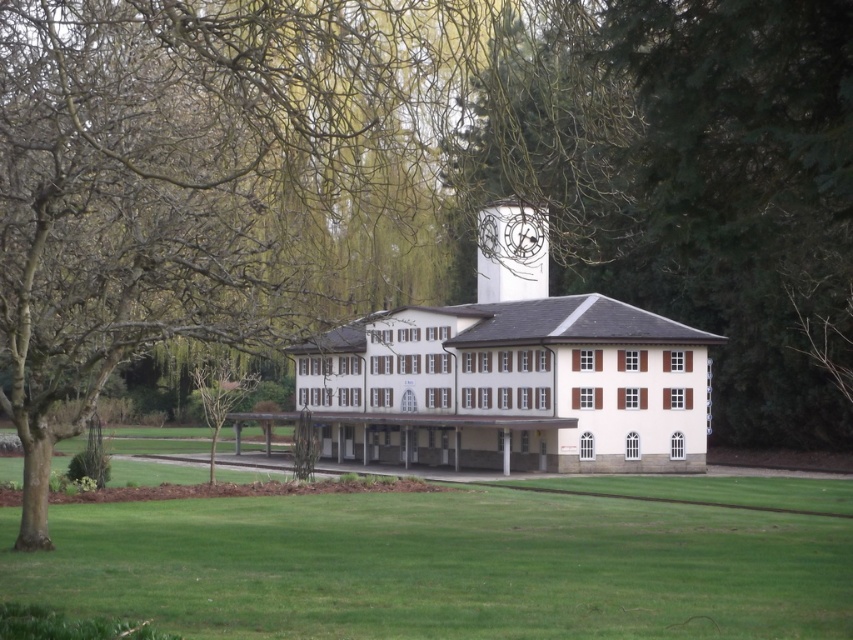
You are standing in front of the two story building and want to determine the relative positions of two points marked on the image. Which point, point (593, 572) or point (489, 266), is closer to you?

Point (593, 572) is closer to the viewer than point (489, 266).

From the picture: You are standing in the park and see the green grass at center and the white painted clock at center. Which one takes up more space in the image?

The green grass at center takes up more space in the image because it is bigger than the white painted clock at center.